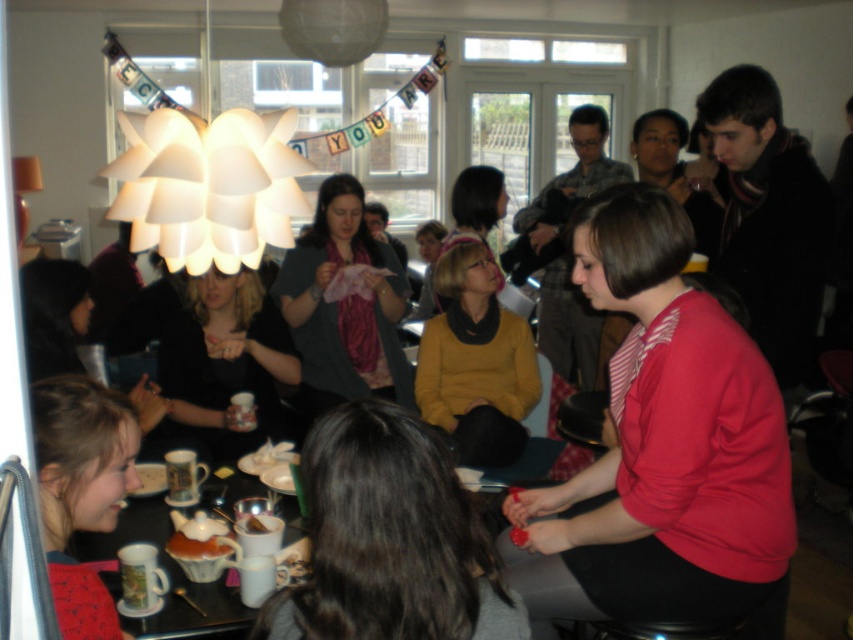
You are at a social gathering and want to introduce yourself to the person with dark brown hair at center. Which direction should you move relative to the matte black sweater at center?

The dark brown hair at center is to the right of the matte black sweater at center, so you should move to the right side of the matte black sweater at center to approach the person with dark brown hair at center.

You are a photographer trying to capture a candid shot of the dark brown hair at center and the matte ceramic mug at lower left. Since you want both subjects to be in focus, you need to know which one is bigger. Can you tell me which one is larger?

The dark brown hair at center is larger in size than the matte ceramic mug at lower left, so you should focus on the dark brown hair at center to ensure both are in focus.

You are at the gathering and want to greet someone with dark brown hair at center. Where should you look to find them?

The dark brown hair at center is located at point (389, 540), so you should look there to find them.